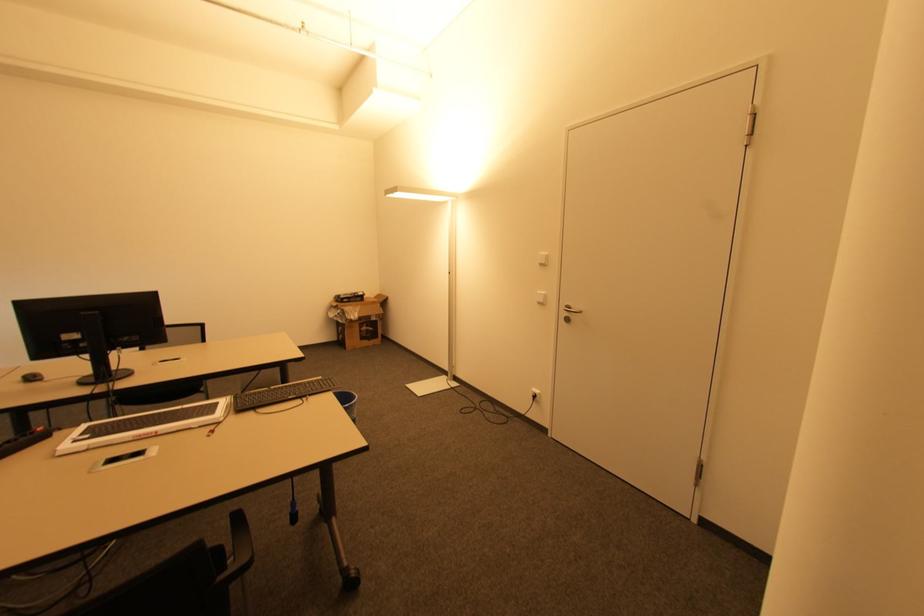
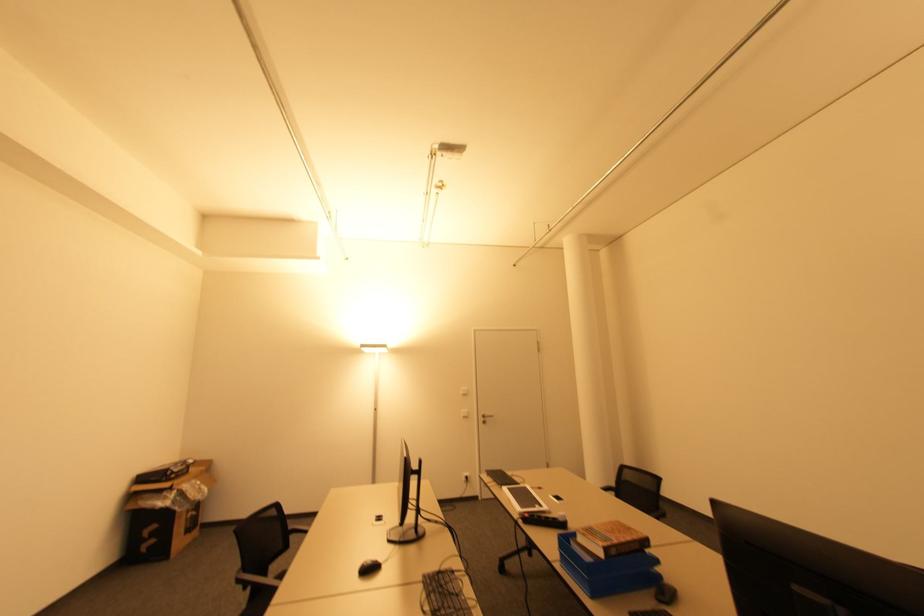
In the second image, find the point that corresponds to point (541, 302) in the first image.

(467, 416)